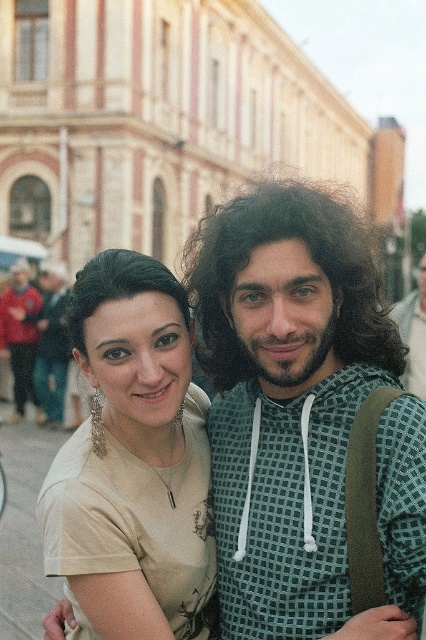
Question: Estimate the real-world distances between objects in this image. Which object is farther from the matte beige shirt at center?

Choices:
 (A) beige fabric shirt at center
 (B) red jacket at left
 (C) curly brown hair at center
 (D) dark brown shiny hair at upper left

Answer: (B)

Question: Is beige fabric shirt at center above dark brown shiny hair at upper left?

Choices:
 (A) yes
 (B) no

Answer: (B)

Question: Which point is closer to the camera?

Choices:
 (A) (83, 323)
 (B) (49, 392)
 (C) (227, 317)
 (D) (69, 561)

Answer: (D)

Question: Is curly brown hair at center to the right of dark brown shiny hair at upper left from the viewer's perspective?

Choices:
 (A) yes
 (B) no

Answer: (A)

Question: Estimate the real-world distances between objects in this image. Which object is closer to the beige fabric shirt at center?

Choices:
 (A) curly brown hair at center
 (B) dark brown shiny hair at upper left

Answer: (B)

Question: From the image, what is the correct spatial relationship of beige fabric shirt at center in relation to curly brown hair at center?

Choices:
 (A) above
 (B) below

Answer: (B)